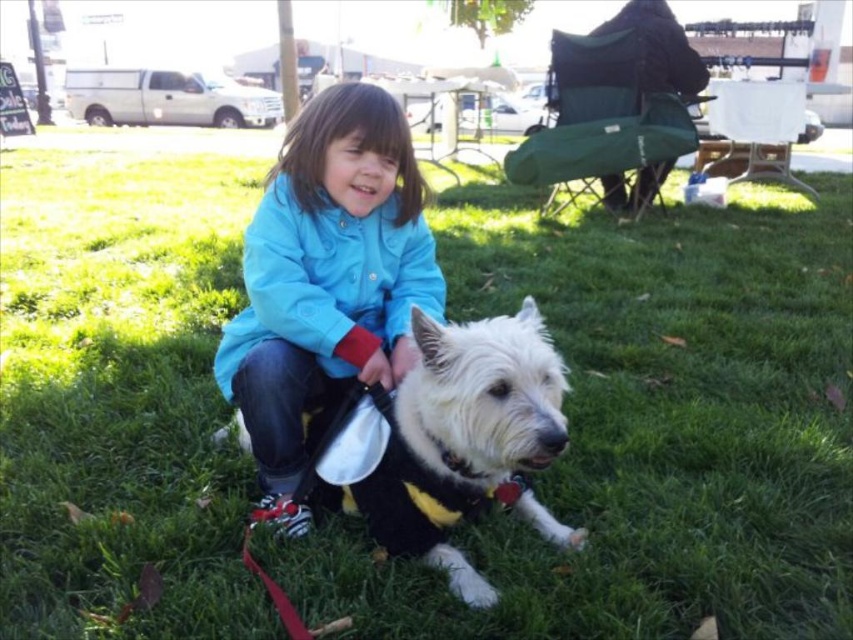
You are standing at the point with coordinates (328,280) in the image. What object is located at that point?

The point at coordinates (328,280) corresponds to the blue fabric jacket at center.

You are a photographer trying to capture a closeup shot of the blue fabric jacket at center and the white fluffy dog at center. Your camera has a minimum focus distance of 35 centimeters. Can you focus on both subjects without moving the camera?

The blue fabric jacket at center is 34.96 centimeters from the white fluffy dog at center, which is just below the camera minimum focus distance of 35 centimeters. Therefore, the camera cannot focus on both subjects without moving the camera closer.

You are a tailor who needs to determine which item is narrower between the blue fabric jacket at center and the white fluffy dog at center. Which one is narrower?

The blue fabric jacket at center is narrower than the white fluffy dog at center.